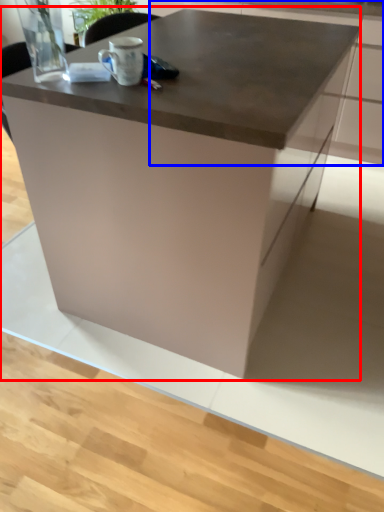
Question: Which point is further to the camera, table (highlighted by a red box) or cabinetry (highlighted by a blue box)?

Choices:
 (A) table
 (B) cabinetry

Answer: (B)